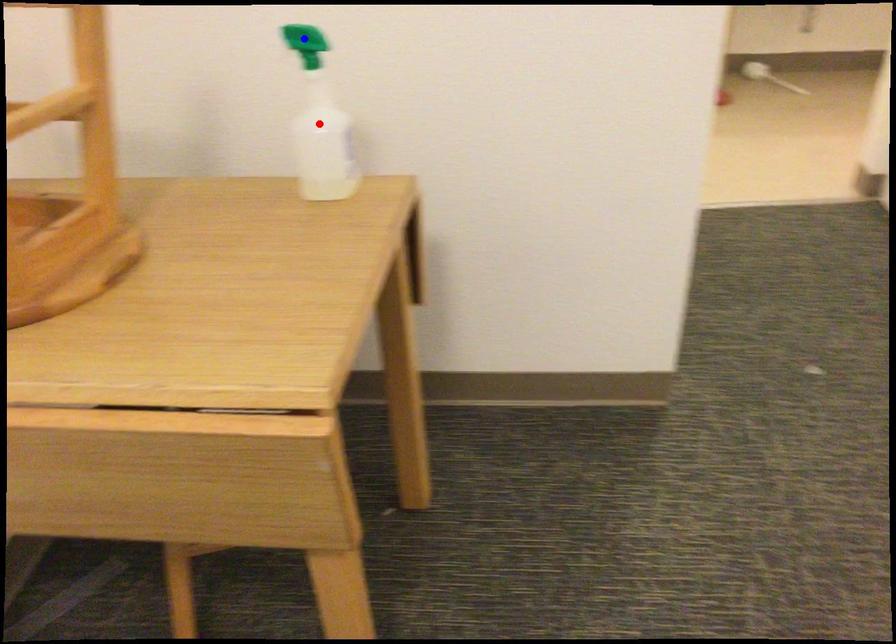
Question: In the image, two points are highlighted. Which point is nearer to the camera? Reply with the corresponding letter.

Choices:
 (A) blue point
 (B) red point

Answer: (A)